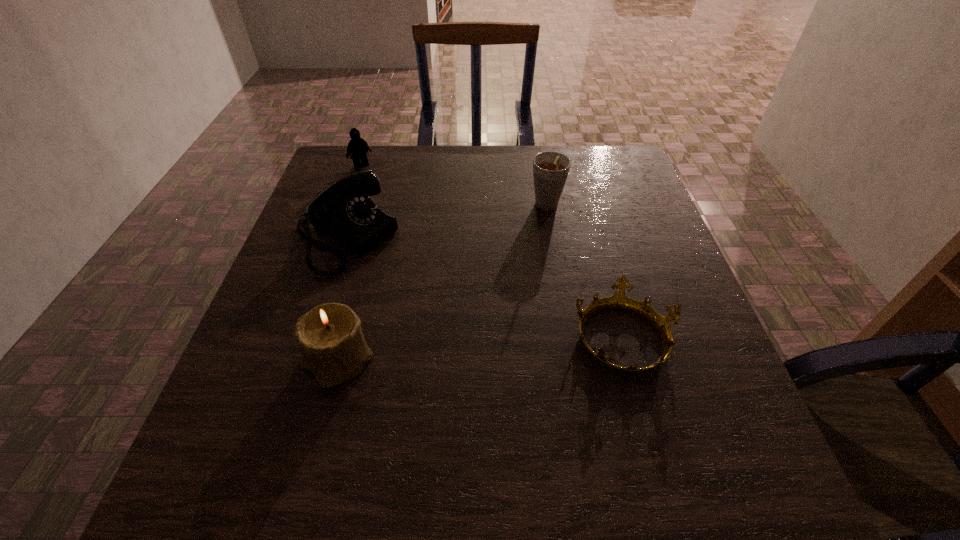
The height and width of the screenshot is (540, 960). I want to click on Lego located in the left edge section of the desktop, so click(358, 147).

Locate an element on the screen. Image resolution: width=960 pixels, height=540 pixels. object that is at the right edge is located at coordinates (619, 301).

Locate an element on the screen. object that is at the far left corner is located at coordinates (358, 147).

Find the location of `vacant space at the far edge`. vacant space at the far edge is located at coordinates (444, 171).

In the image, there is a desktop. Where is `vacant space at the near edge`? vacant space at the near edge is located at coordinates (645, 424).

Identify the location of vacant region at the left edge of the desktop. click(x=293, y=365).

In the image, there is a desktop. Where is `vacant space at the right edge`? Image resolution: width=960 pixels, height=540 pixels. vacant space at the right edge is located at coordinates (627, 232).

Find the location of `free space at the near left corner`. free space at the near left corner is located at coordinates (265, 429).

The height and width of the screenshot is (540, 960). Find the location of `vacant space at the far right corner of the desktop`. vacant space at the far right corner of the desktop is located at coordinates (597, 149).

This screenshot has height=540, width=960. Find the location of `vacant area that lies between the root beer and the Lego`. vacant area that lies between the root beer and the Lego is located at coordinates (454, 187).